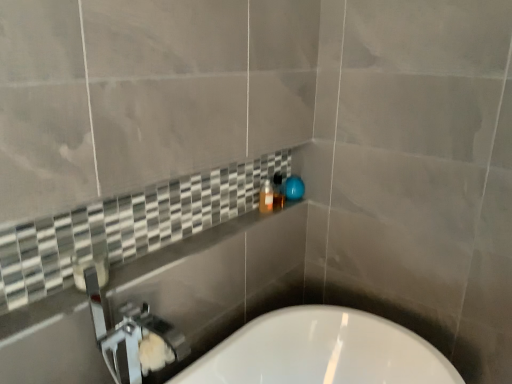
Question: From the image's perspective, is matte black soap dispenser at center on white glossy bathtub at lower center?

Choices:
 (A) yes
 (B) no

Answer: (A)

Question: Does matte black soap dispenser at center have a lesser height compared to white glossy bathtub at lower center?

Choices:
 (A) no
 (B) yes

Answer: (B)

Question: Is matte black soap dispenser at center next to white glossy bathtub at lower center and touching it?

Choices:
 (A) yes
 (B) no

Answer: (B)

Question: Considering the relative sizes of matte black soap dispenser at center and white glossy bathtub at lower center in the image provided, is matte black soap dispenser at center bigger than white glossy bathtub at lower center?

Choices:
 (A) yes
 (B) no

Answer: (B)

Question: Could you tell me if matte black soap dispenser at center is facing white glossy bathtub at lower center?

Choices:
 (A) yes
 (B) no

Answer: (B)

Question: Is matte black soap dispenser at center surrounding white glossy bathtub at lower center?

Choices:
 (A) yes
 (B) no

Answer: (B)

Question: Would you say translucent plastic bottle at upper center contains white glossy bathtub at lower center?

Choices:
 (A) yes
 (B) no

Answer: (B)

Question: Does translucent plastic bottle at upper center turn towards white glossy bathtub at lower center?

Choices:
 (A) yes
 (B) no

Answer: (B)

Question: Does translucent plastic bottle at upper center have a lesser height compared to white glossy bathtub at lower center?

Choices:
 (A) no
 (B) yes

Answer: (B)

Question: From the image's perspective, is translucent plastic bottle at upper center over white glossy bathtub at lower center?

Choices:
 (A) no
 (B) yes

Answer: (B)

Question: Is translucent plastic bottle at upper center outside of white glossy bathtub at lower center?

Choices:
 (A) no
 (B) yes

Answer: (B)

Question: From a real-world perspective, is translucent plastic bottle at upper center over white glossy bathtub at lower center?

Choices:
 (A) no
 (B) yes

Answer: (B)

Question: Is white glossy bathtub at lower center touching translucent plastic bottle at upper center?

Choices:
 (A) yes
 (B) no

Answer: (B)